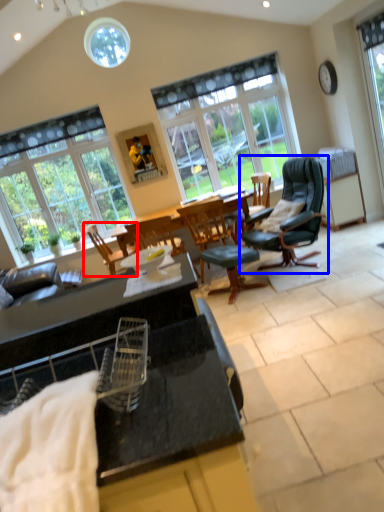
Question: Which object is further to the camera taking this photo, chair (highlighted by a red box) or chair (highlighted by a blue box)?

Choices:
 (A) chair
 (B) chair

Answer: (A)